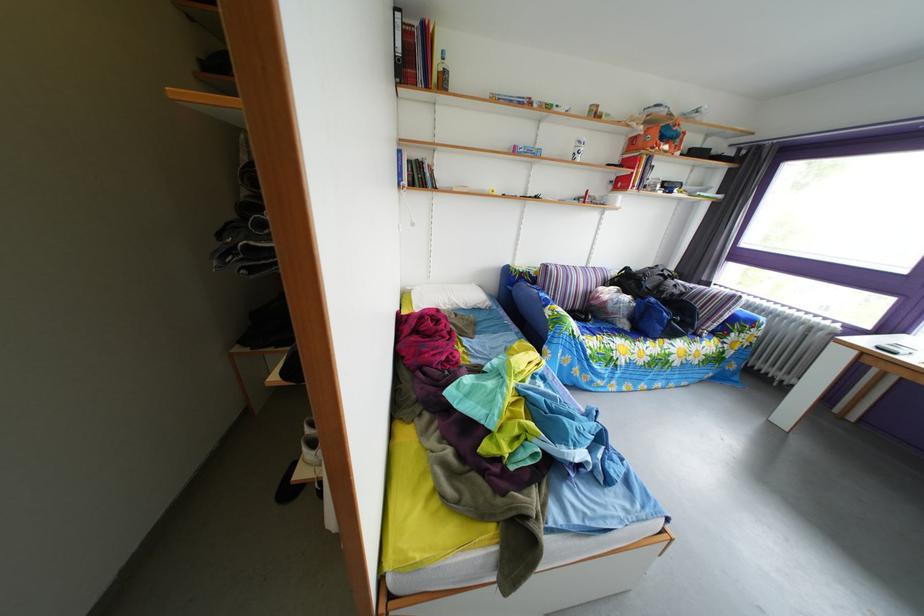
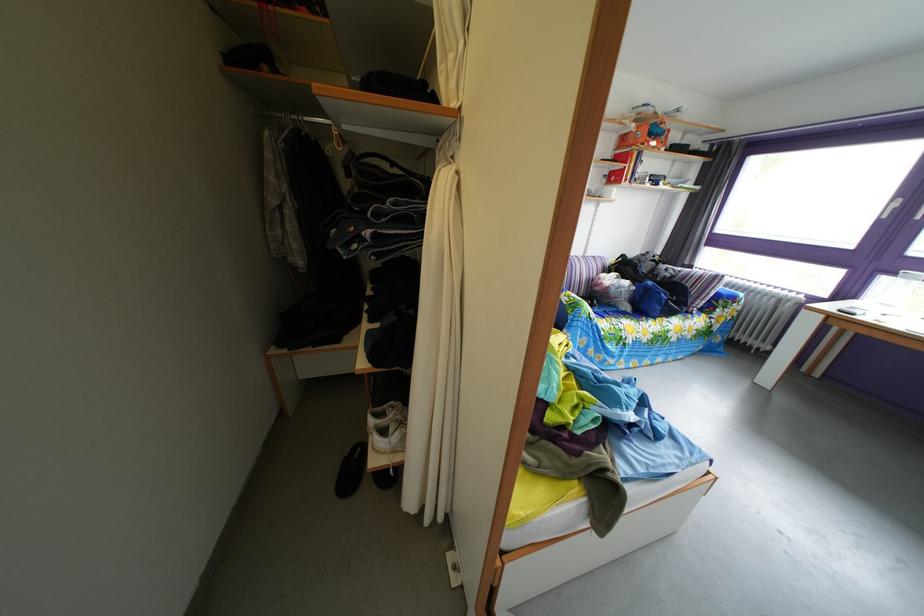
In the second image, find the point that corresponds to (636,333) in the first image.

(638, 315)